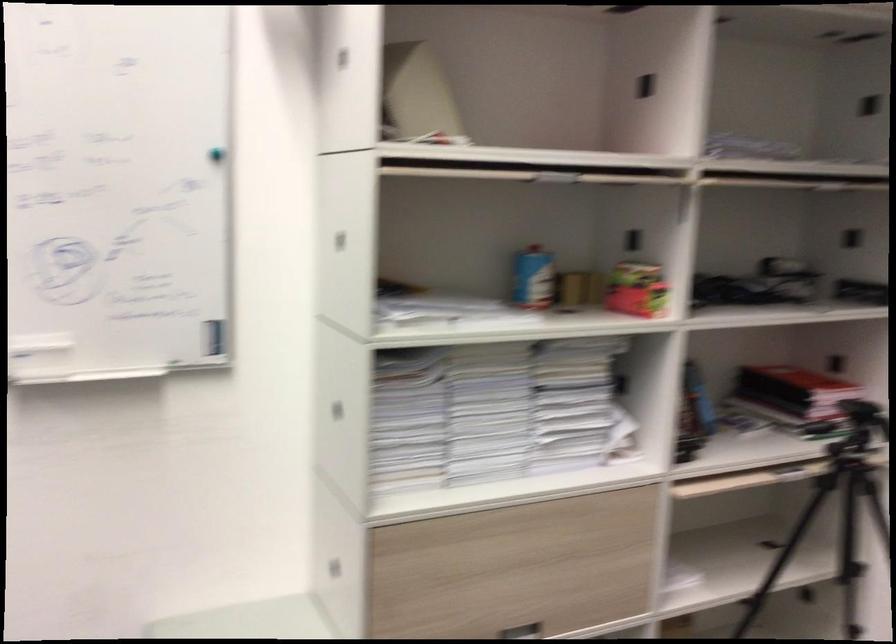
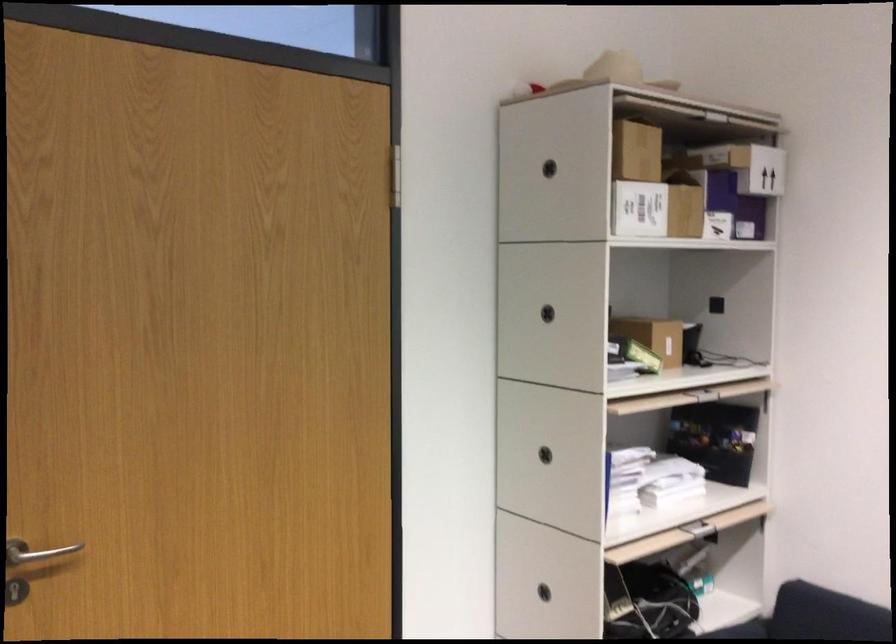
Question: The camera is either moving clockwise (left) or counter-clockwise (right) around the object. The first image is from the beginning of the video and the second image is from the end. Is the camera moving left or right when shooting the video?

Choices:
 (A) Left
 (B) Right

Answer: (A)